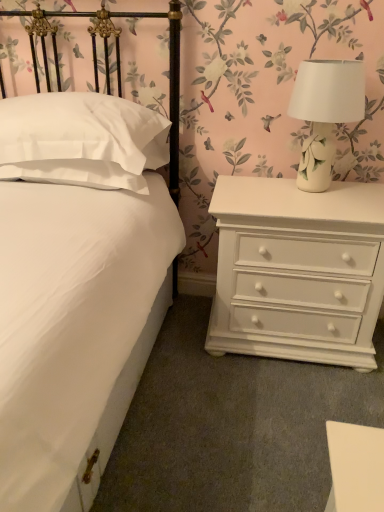
Locate an element on the screen. unoccupied region to the right of white ceramic lamp at upper right is located at coordinates pos(365,188).